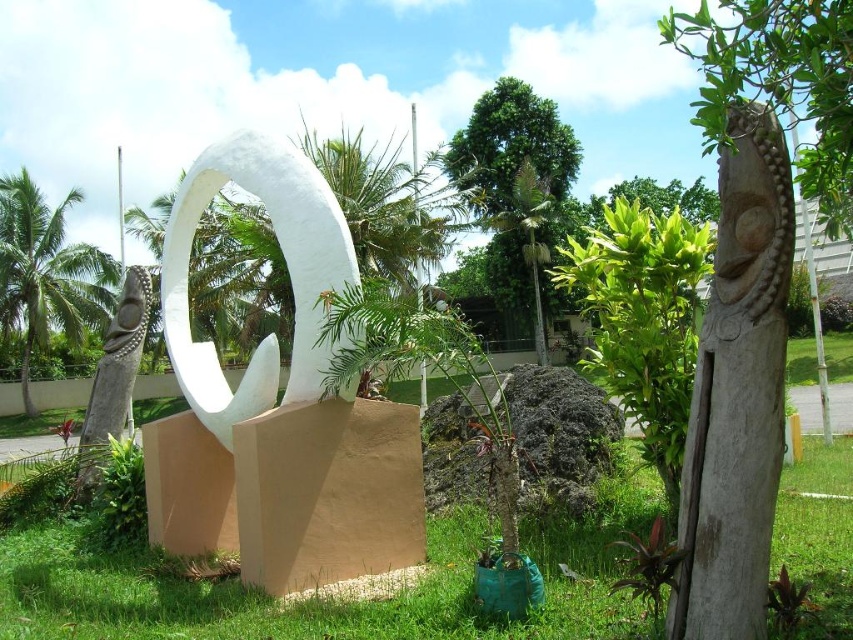
You are planning to install a new bench in this outdoor area. The bench requires a minimum of 20 meters of space between it and any existing structures. If you place the bench exactly halfway between the white matte sculpture at center and the green leafy palm tree at center, will this placement meet the required distance? Please explain your reasoning.

The distance between the white matte sculpture at center and the green leafy palm tree at center is 21.60 meters. Placing the bench halfway would mean it is 10.80 meters away from each structure. Since 10.80 meters is less than the required 20 meters, the placement does not meet the minimum distance requirement.

You are standing in the outdoor area and want to take a photo of the white matte sculpture at center and the green leafy palm tree at center. Which object should you position to your left to capture both in the frame?

You should position the white matte sculpture at center to your left since it is already to the left of the green leafy palm tree at center, allowing both to be captured in the frame.

You are standing in the outdoor area and want to take a photo of both the white matte sculpture at center and the green leafy tree at center. Which object should you position to your left to include both in the frame?

You should position the white matte sculpture at center to your left since it is already to the left of the green leafy tree at center, allowing both to be captured in the photo.